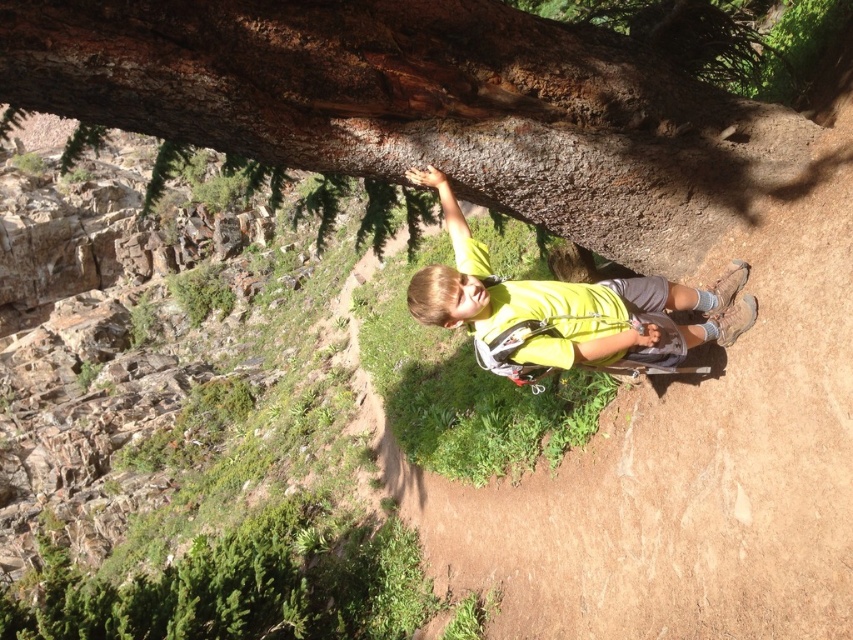
Question: Which of the following is the farthest from the observer?

Choices:
 (A) smooth brown bark at upper center
 (B) yellow fabric shirt at center

Answer: (B)

Question: Which point appears closest to the camera in this image?

Choices:
 (A) (537, 352)
 (B) (631, 154)

Answer: (A)

Question: Is smooth brown bark at upper center closer to the viewer compared to yellow fabric shirt at center?

Choices:
 (A) yes
 (B) no

Answer: (A)

Question: Can you confirm if smooth brown bark at upper center is positioned below yellow fabric shirt at center?

Choices:
 (A) yes
 (B) no

Answer: (B)

Question: Can you confirm if smooth brown bark at upper center is thinner than yellow fabric shirt at center?

Choices:
 (A) no
 (B) yes

Answer: (A)